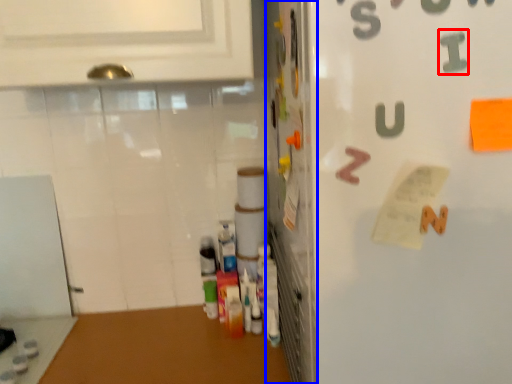
Question: Which of the following is the farthest to the observer, alphabet (highlighted by a red box) or door (highlighted by a blue box)?

Choices:
 (A) alphabet
 (B) door

Answer: (B)